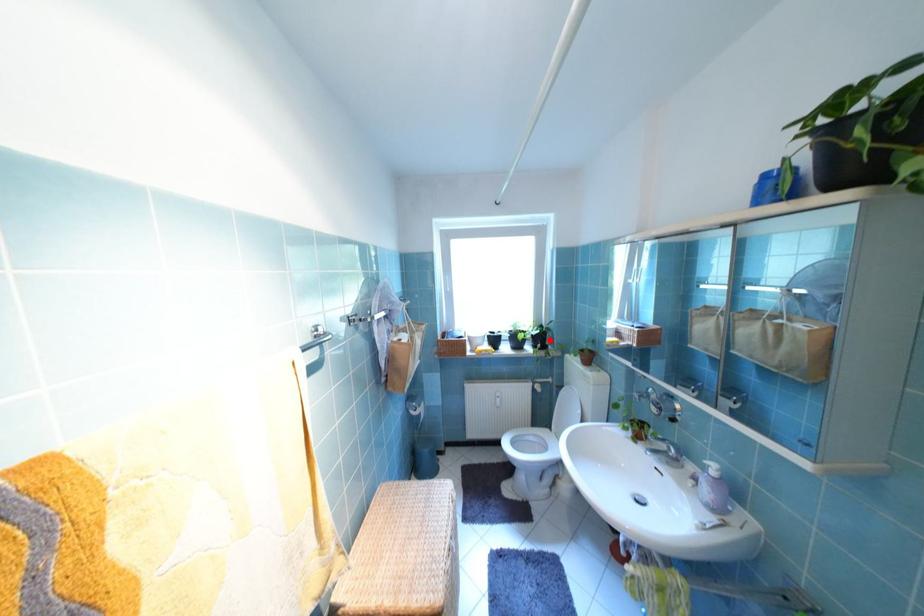
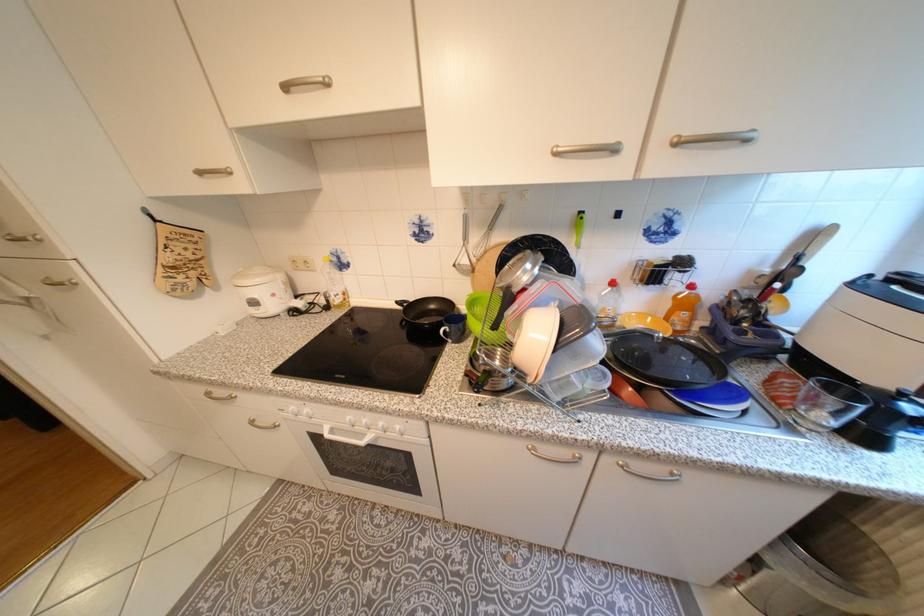
Question: I am providing you with two images of the same scene from different viewpoints. A red point is marked on the first image. Is the red point's position out of view in image 2?

Choices:
 (A) Yes
 (B) No

Answer: (A)